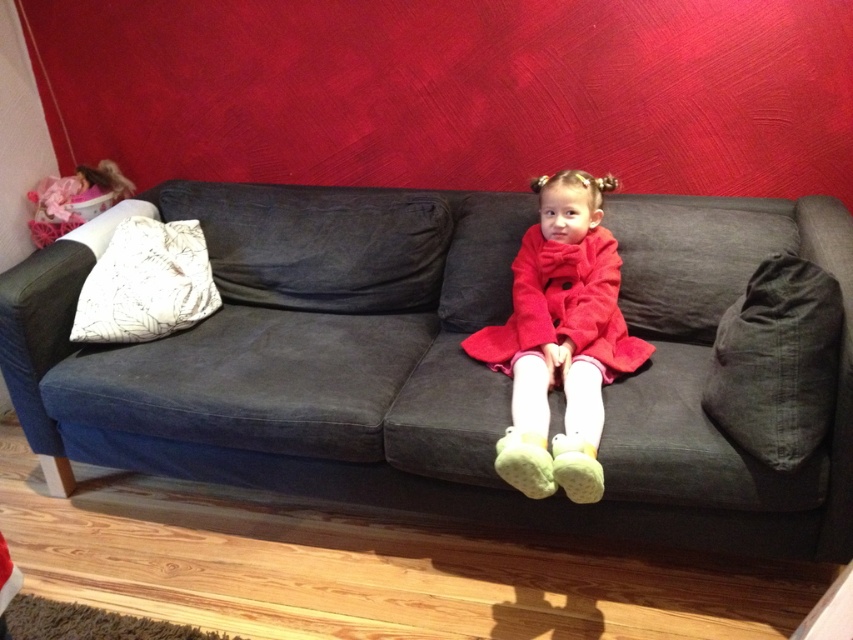
You are trying to decide whether to place a large decorative item on the dark gray fabric couch at center or the dark gray fabric pillow at right. Based on their sizes, which one would be more suitable for the item?

The dark gray fabric couch at center is bigger than the dark gray fabric pillow at right, so it would be more suitable for placing a large decorative item.